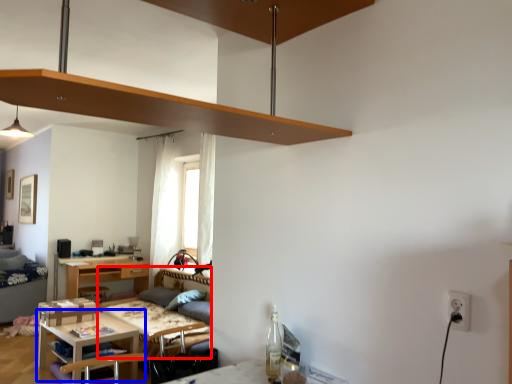
Question: Which point is closer to the camera, couch (highlighted by a red box) or table (highlighted by a blue box)?

Choices:
 (A) couch
 (B) table

Answer: (A)